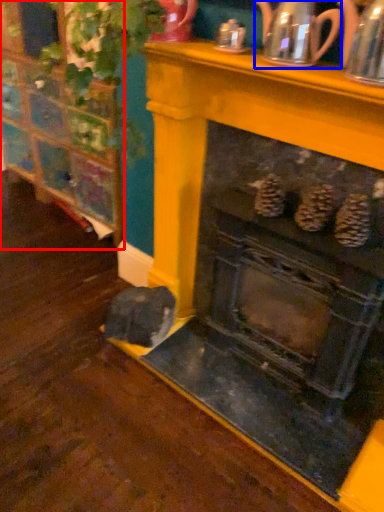
Question: Which object is further to the camera taking this photo, furniture (highlighted by a red box) or tea pot (highlighted by a blue box)?

Choices:
 (A) furniture
 (B) tea pot

Answer: (A)